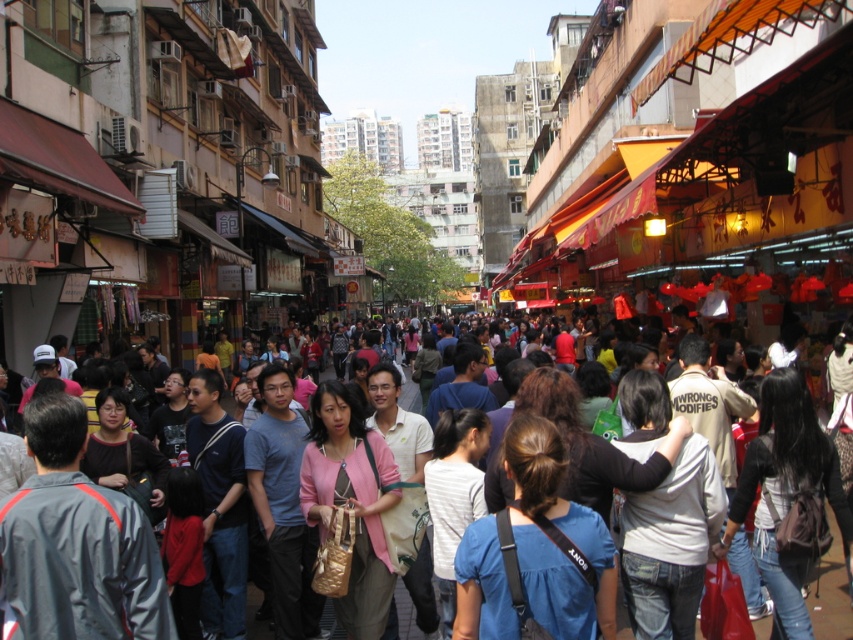
You are a photographer trying to capture a candid shot of the two people wearing the white striped shirt at center and the matte black jacket at center. Since you want to focus on their clothing, which clothing item should you zoom in on to ensure it appears larger in your photo?

The white striped shirt at center is taller than the matte black jacket at center, so you should zoom in on the white striped shirt at center to make it appear larger in the photo.